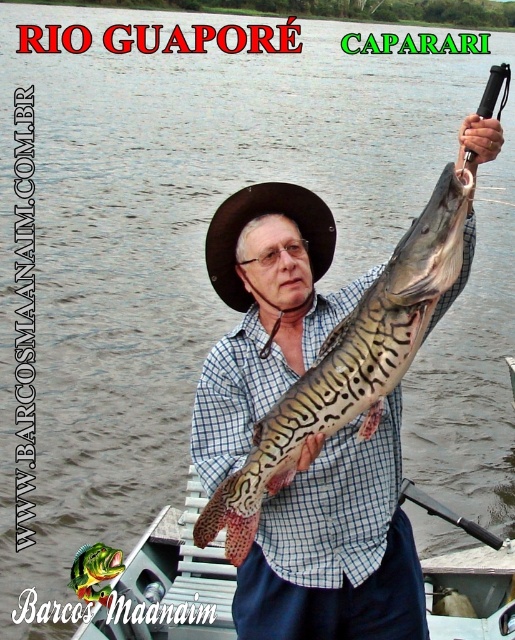
You are a photographer taking a picture of the speckled skin fish at center and the brown felt cowboy hat at upper center. Which object is closer to the camera?

The speckled skin fish at center is positioned under brown felt cowboy hat at upper center, meaning the fish is closer to the camera than the hat.

You are an angler who just caught a fish. You want to know if the speckled skin fish at center can fit into your 12 inch wide fish basket. The brown felt cowboy hat at upper center is 8 inches wide. Can the fish fit?

The speckled skin fish at center is wider than the brown felt cowboy hat at upper center, which is 8 inches wide. Since the fish is wider than 8 inches, it may not fit into the 12 inch wide fish basket.